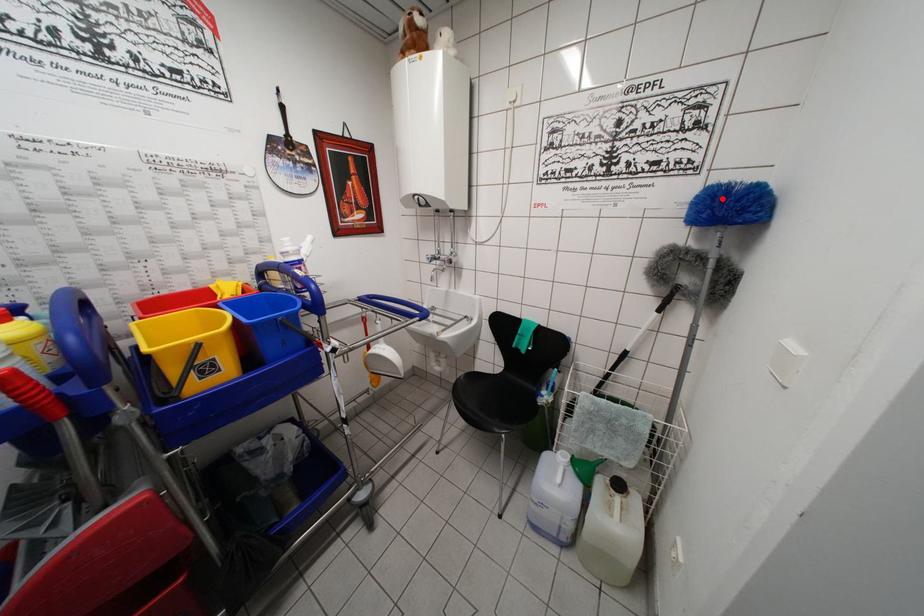
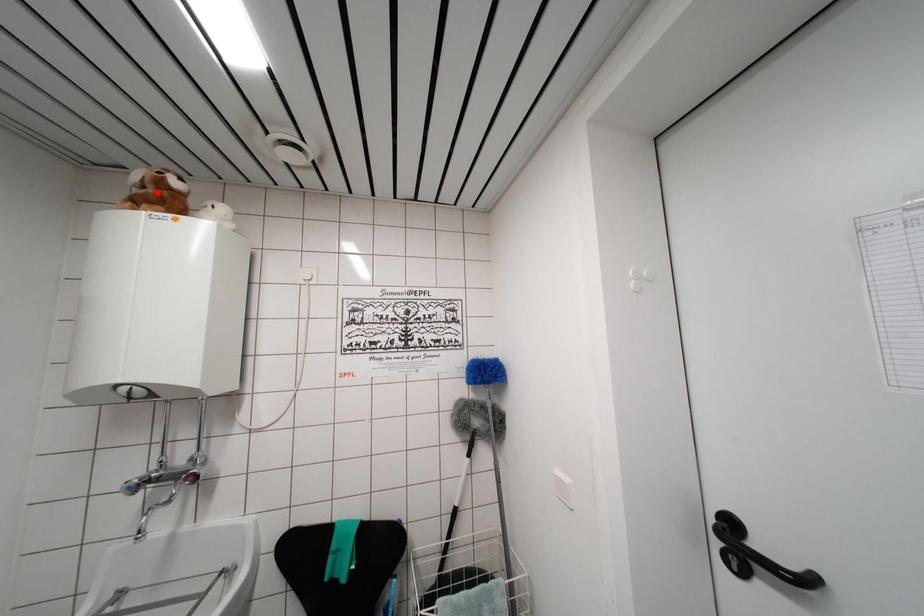
I am providing you with two images of the same scene from different viewpoints. A red point is marked on the first image and another point is marked on the second image. Is the marked point in image1 the same physical position as the marked point in image2?

No